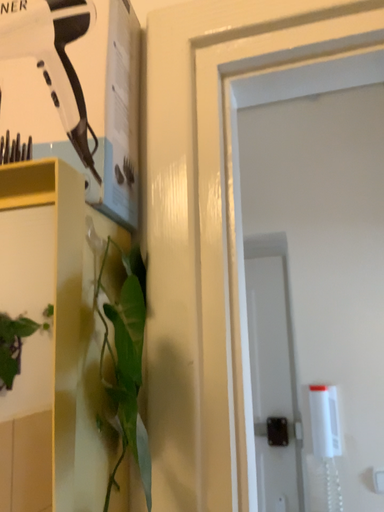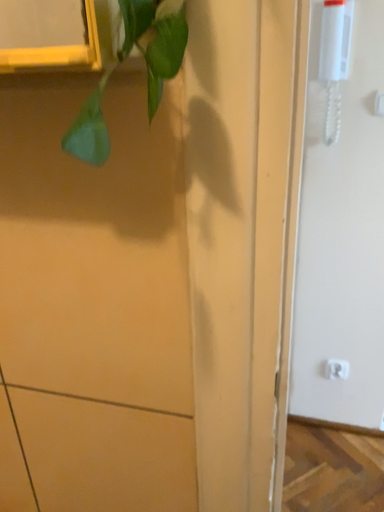
Question: How did the camera likely rotate when shooting the video?

Choices:
 (A) rotated downward
 (B) rotated upward

Answer: (A)